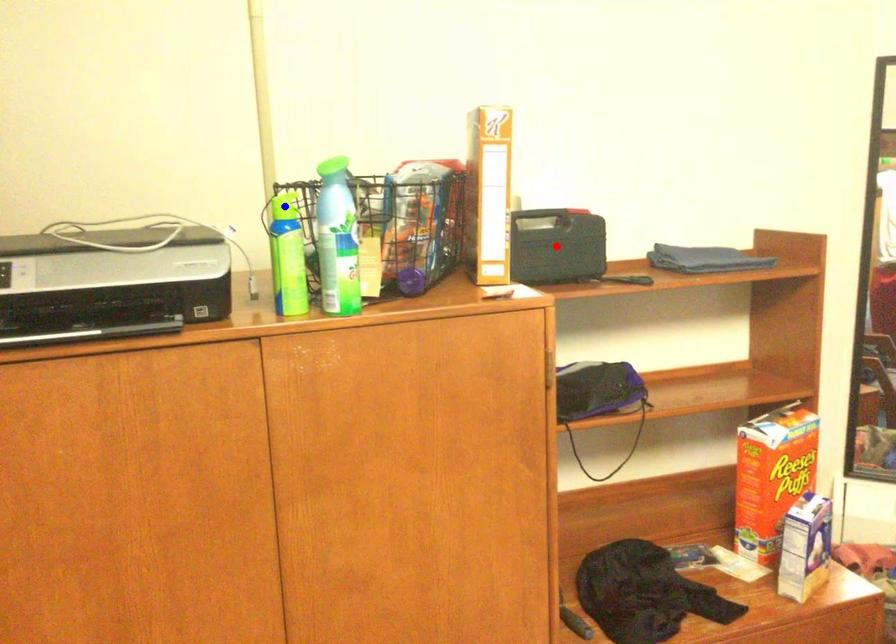
Question: Two points are marked on the image. Which point is closer to the camera?

Choices:
 (A) Blue point is closer.
 (B) Red point is closer.

Answer: (A)